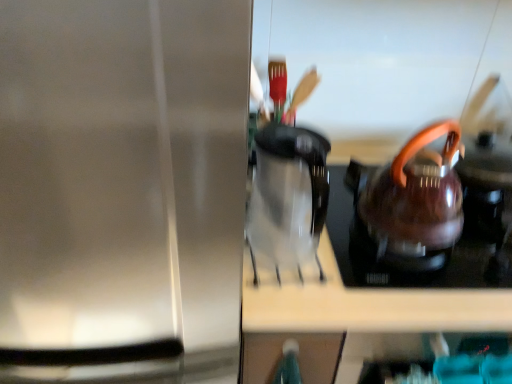
Question: Looking at the image, does shiny metallic kettle at right seem bigger or smaller compared to transparent glass coffee pot at center?

Choices:
 (A) small
 (B) big

Answer: (B)

Question: Which is correct: shiny metallic kettle at right is inside transparent glass coffee pot at center, or outside of it?

Choices:
 (A) inside
 (B) outside

Answer: (B)

Question: Which is farther from the shiny metallic kettle at right?

Choices:
 (A) transparent glass coffee pot at center
 (B) stainless steel kettle at right

Answer: (B)

Question: Based on their relative distances, which object is nearer to the stainless steel kettle at right?

Choices:
 (A) shiny metallic kettle at right
 (B) transparent glass coffee pot at center

Answer: (B)